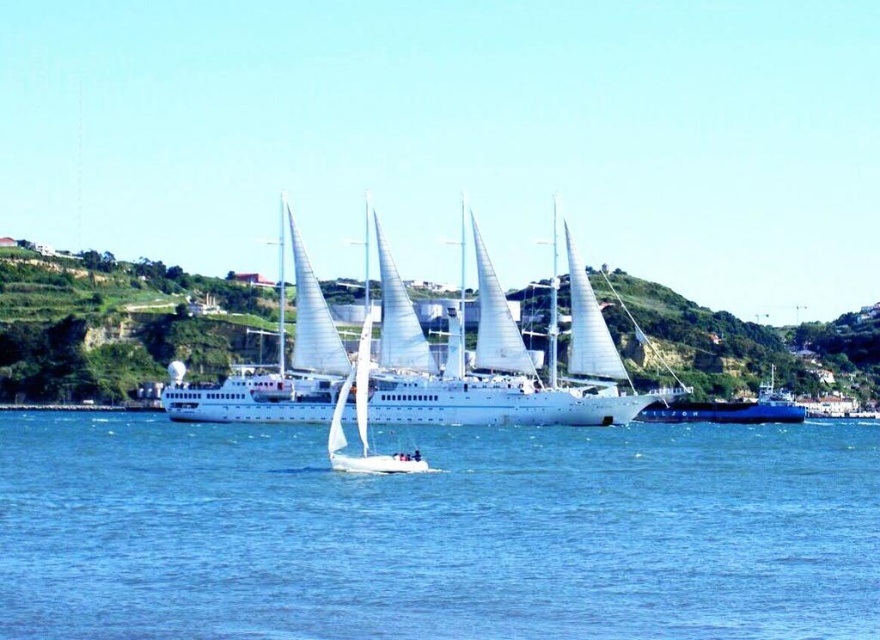
You are standing on the deck of the large sailing ship and want to take a photo of the small sailboat in the foreground. You notice two points marked on your camera screen at coordinates point [380,512] and point [367,339]. Which point is closer to the camera and should be focused on to ensure the small sailboat is in sharp focus?

Point [380,512] is closer to the camera than point [367,339], so focusing on point [380,512] will ensure the small sailboat in the foreground is in sharp focus.

Where is the blue water at center located in the image?

The blue water at center is located at point (437,532).

From the picture: You are a seagull flying above the maritime scene. You want to land on the tallest object between the white glossy ship at center and the white matte sailboat at center. Which one should you choose?

The white glossy ship at center has a lesser height compared to the white matte sailboat at center, so you should choose the white matte sailboat at center as it is taller.